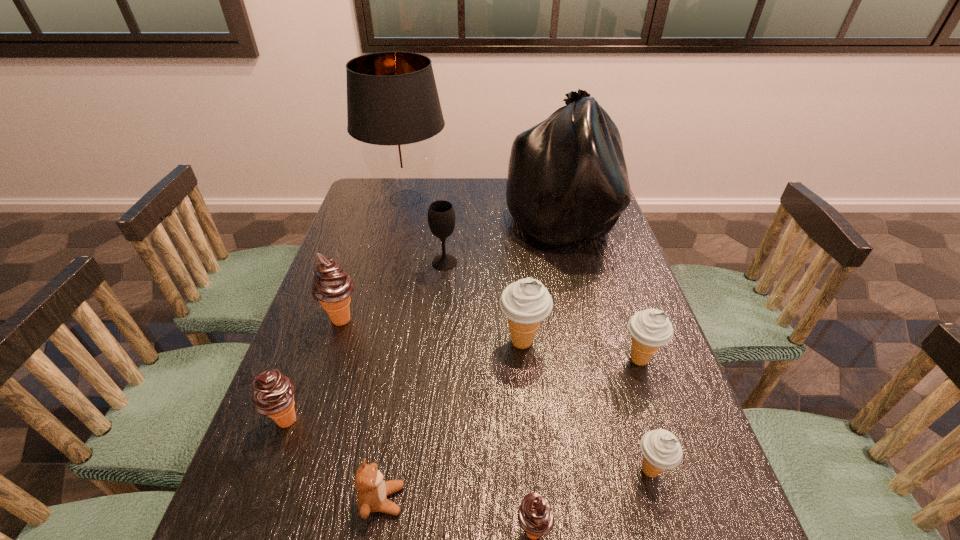
I want to click on vacant area that lies between the wineglass and the leftmost beige icecream, so click(x=484, y=302).

I want to click on free area in between the second biggest beige icecream and the biggest chocolate icecream, so click(x=491, y=340).

Find the location of a particular element. This screenshot has width=960, height=540. empty location between the farthest chocolate icecream and the teddy bear is located at coordinates (362, 409).

At what (x,y) coordinates should I click in order to perform the action: click on vacant point located between the plastic bag and the nearest beige icecream. Please return your answer as a coordinate pair (x, y). Looking at the image, I should click on (605, 346).

Where is `vacant space that is in between the smallest beige icecream and the second smallest beige icecream`? Image resolution: width=960 pixels, height=540 pixels. vacant space that is in between the smallest beige icecream and the second smallest beige icecream is located at coordinates (645, 415).

This screenshot has height=540, width=960. I want to click on the fourth closest object to the wineglass, so click(526, 302).

Identify the location of the fifth closest object to the biggest beige icecream. point(372,493).

Choose which icecream is the fourth nearest neighbor to the teddy bear. Please provide its 2D coordinates. Your answer should be formatted as a tuple, i.e. [(x, y)], where the tuple contains the x and y coordinates of a point satisfying the conditions above.

[(331, 286)]

In order to click on the sixth closest icecream to the plastic bag in this screenshot , I will do `click(535, 516)`.

Identify which beige icecream is the closest to the second nearest icecream. Please provide its 2D coordinates. Your answer should be formatted as a tuple, i.e. [(x, y)], where the tuple contains the x and y coordinates of a point satisfying the conditions above.

[(650, 329)]